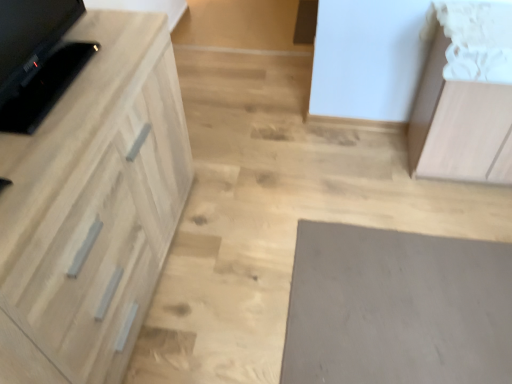
The height and width of the screenshot is (384, 512). In order to click on free space in front of light brown wood cabinet at upper right, the 1th cabinetry when ordered from right to left in this screenshot , I will do [465, 214].